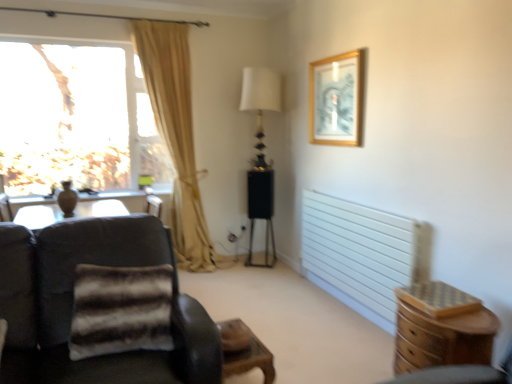
I want to click on empty space that is ontop of wooden chest of drawers at lower right, so click(450, 306).